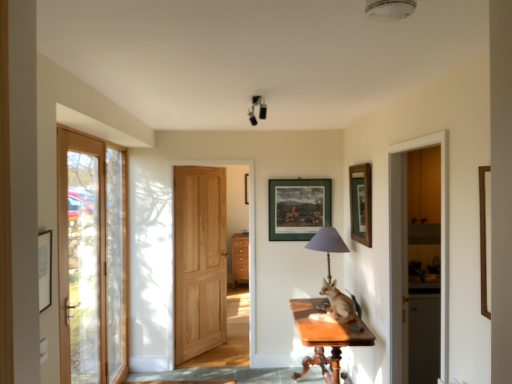
Question: Is clear glass door at left, placed as the first door when sorted from left to right, turned away from smooth stone path at lower center?

Choices:
 (A) no
 (B) yes

Answer: (A)

Question: Is clear glass door at left, marked as the second door in a back-to-front arrangement, aimed at smooth stone path at lower center?

Choices:
 (A) no
 (B) yes

Answer: (A)

Question: Is clear glass door at left, the second door viewed from the right, bigger than smooth stone path at lower center?

Choices:
 (A) yes
 (B) no

Answer: (A)

Question: Is clear glass door at left, marked as the second door in a back-to-front arrangement, thinner than smooth stone path at lower center?

Choices:
 (A) no
 (B) yes

Answer: (B)

Question: Is clear glass door at left, placed as the first door when sorted from left to right, located outside smooth stone path at lower center?

Choices:
 (A) no
 (B) yes

Answer: (B)

Question: Considering their positions, is wooden picture frame at upper right, which is the 2th picture frame in back-to-front order, located in front of or behind green matte picture frame at center, which is the first picture frame from back to front?

Choices:
 (A) front
 (B) behind

Answer: (A)

Question: Considering the relative positions of wooden picture frame at upper right, which is the 2th picture frame in back-to-front order, and green matte picture frame at center, the 2th picture frame in the right-to-left sequence, in the image provided, is wooden picture frame at upper right, which is the 2th picture frame in back-to-front order, to the left or to the right of green matte picture frame at center, the 2th picture frame in the right-to-left sequence,?

Choices:
 (A) left
 (B) right

Answer: (B)

Question: Considering the positions of point (352, 228) and point (323, 216), is point (352, 228) closer or farther from the camera than point (323, 216)?

Choices:
 (A) farther
 (B) closer

Answer: (B)

Question: From a real-world perspective, is wooden picture frame at upper right, positioned as the 1th picture frame in front-to-back order, physically located above or below green matte picture frame at center, which is the first picture frame from back to front?

Choices:
 (A) below
 (B) above

Answer: (B)

Question: Is green matte picture frame at center, which is the 1th picture frame in left-to-right order, bigger or smaller than wooden picture frame at upper right, arranged as the 2th picture frame when viewed from the left?

Choices:
 (A) big
 (B) small

Answer: (B)

Question: Is green matte picture frame at center, marked as the 2th picture frame in a front-to-back arrangement, in front of or behind wooden picture frame at upper right, arranged as the 2th picture frame when viewed from the left, in the image?

Choices:
 (A) front
 (B) behind

Answer: (B)

Question: Is green matte picture frame at center, the 2th picture frame in the right-to-left sequence, to the left or to the right of wooden picture frame at upper right, which is the 2th picture frame in back-to-front order, in the image?

Choices:
 (A) left
 (B) right

Answer: (A)

Question: Is green matte picture frame at center, which is the first picture frame from back to front, inside the boundaries of wooden picture frame at upper right, the first picture frame positioned from the right, or outside?

Choices:
 (A) inside
 (B) outside

Answer: (B)

Question: In the image, is smooth stone path at lower center positioned in front of or behind clear glass door at left, marked as the second door in a back-to-front arrangement?

Choices:
 (A) behind
 (B) front

Answer: (A)

Question: Choose the correct answer: Is smooth stone path at lower center inside clear glass door at left, marked as the second door in a back-to-front arrangement, or outside it?

Choices:
 (A) inside
 (B) outside

Answer: (B)